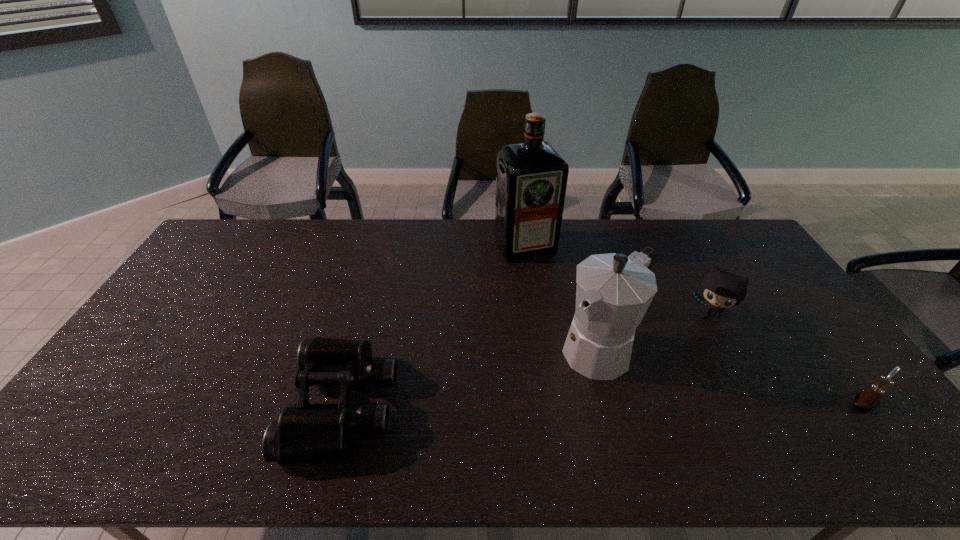
This screenshot has width=960, height=540. I want to click on vacant space on the desktop that is between the leftmost object and the padlock and is positioned on the front-facing side of the third shortest object, so click(x=673, y=403).

Where is `vacant space on the desktop that is between the binoculars and the padlock and is positioned at the spout of the coffeepot`? vacant space on the desktop that is between the binoculars and the padlock and is positioned at the spout of the coffeepot is located at coordinates (541, 404).

In order to click on free space on the desktop that is between the binoculars and the rightmost object and is positioned on the front label of the liquor in this screenshot , I will do `click(612, 404)`.